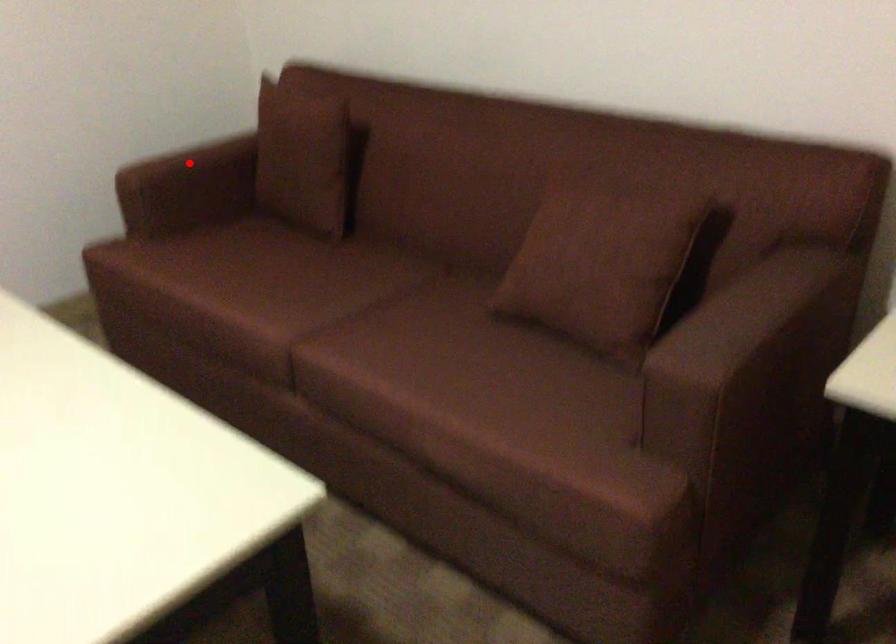
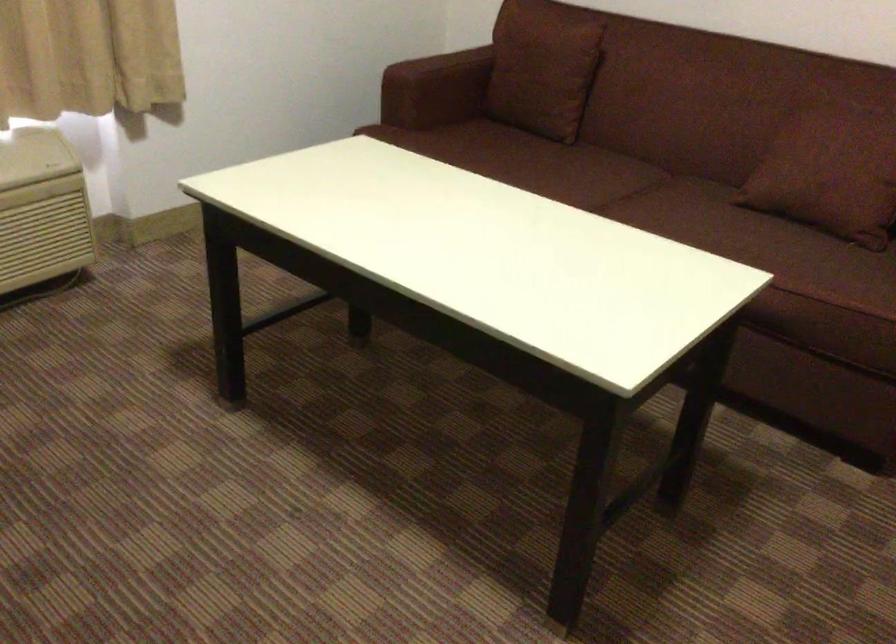
Question: A red point is marked in image1. In image2, is the corresponding 3D point closer to the camera or farther? Reply with the corresponding letter.

Choices:
 (A) The corresponding 3D point is closer.
 (B) The corresponding 3D point is farther.

Answer: (B)